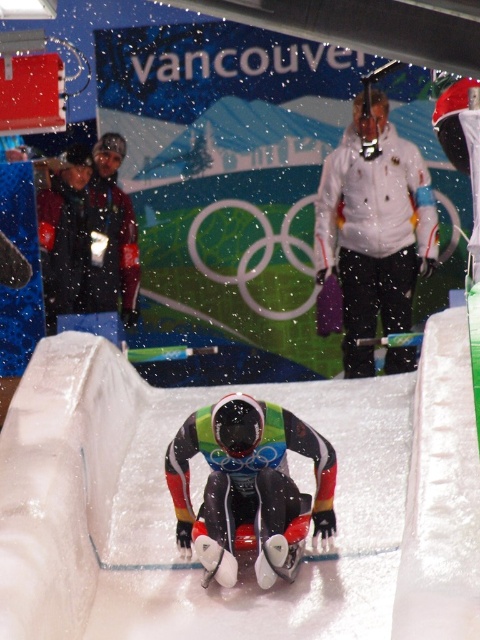
Based on the photo, you are a photographer at the 2010 Winter Olympics in Vancouver. You need to capture a photo of the white matte jacket at upper center and the multicolored glossy suit at center. Which object should you zoom in on to ensure both are fully visible in the frame?

The white matte jacket at upper center is wider than the multicolored glossy suit at center, so you should zoom in on the white matte jacket at upper center to ensure both are fully visible in the frame.

You are a photographer at the Winter Olympics venue. You need to capture a photo of the white matte jacket at upper center and the multicolored glossy suit at center. Which object should you focus on first if you want to include both in the frame without moving the camera?

The white matte jacket at upper center is much taller than the multicolored glossy suit at center, so you should focus on the white matte jacket at upper center first to ensure it fits within the frame.